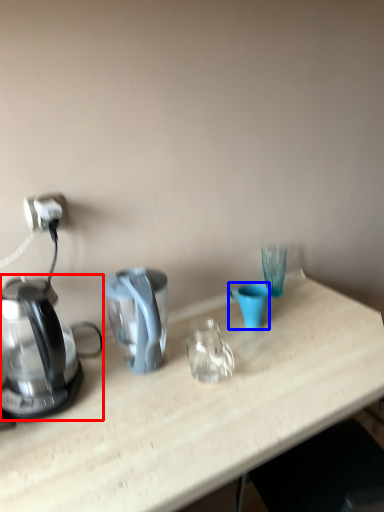
Question: Which object is closer to the camera taking this photo, kettle (highlighted by a red box) or coffee cup (highlighted by a blue box)?

Choices:
 (A) kettle
 (B) coffee cup

Answer: (A)